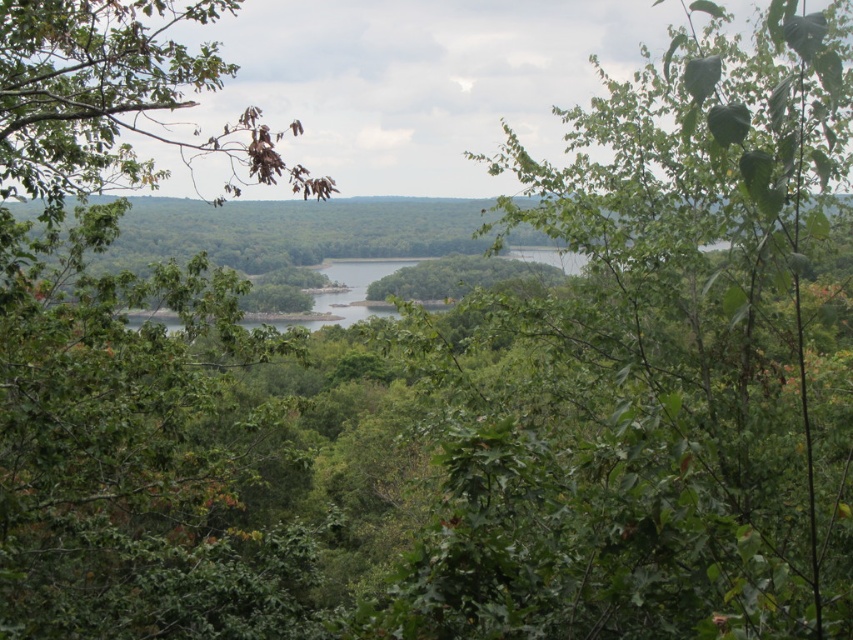
Question: Which object appears closest to the camera in this image?

Choices:
 (A) green leafy tree at left
 (B) green leafy tree at center

Answer: (B)

Question: Is green leafy tree at center above green leafy tree at left?

Choices:
 (A) yes
 (B) no

Answer: (B)

Question: Which of the following is the farthest from the observer?

Choices:
 (A) (746, 84)
 (B) (51, 260)

Answer: (B)

Question: Is green leafy tree at center smaller than green leafy tree at left?

Choices:
 (A) yes
 (B) no

Answer: (A)

Question: Which object is farther from the camera taking this photo?

Choices:
 (A) green leafy tree at left
 (B) green leafy tree at center

Answer: (A)

Question: Is green leafy tree at center thinner than green leafy tree at left?

Choices:
 (A) no
 (B) yes

Answer: (B)